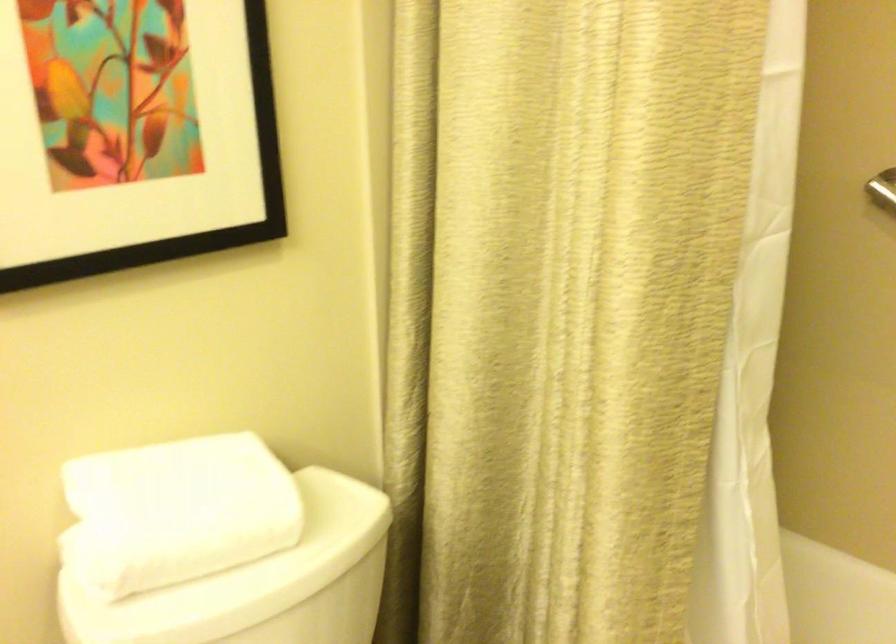
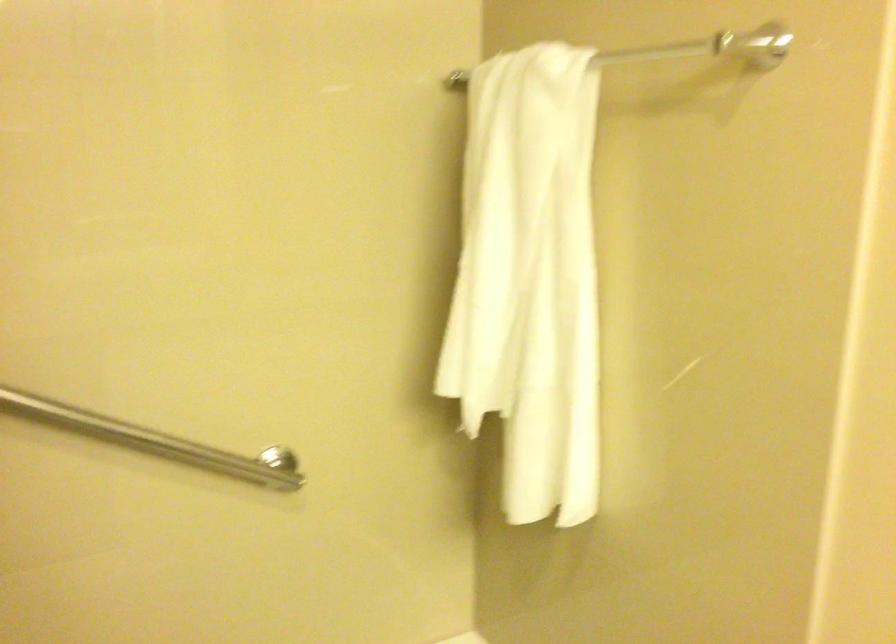
Question: The images are taken continuously from a first-person perspective. In which direction is your viewpoint rotating?

Choices:
 (A) Left
 (B) Right
 (C) Up
 (D) Down

Answer: (B)